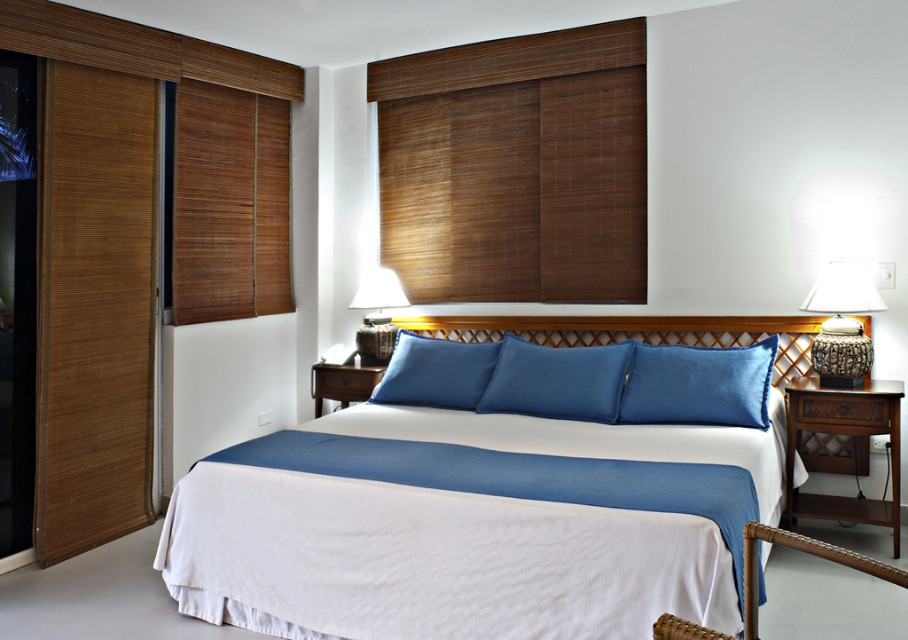
Question: Does blue fabric pillow at center have a greater width compared to blue matte pillow at center?

Choices:
 (A) yes
 (B) no

Answer: (A)

Question: Is brown woven blinds at upper center above rattan textured lamp at right?

Choices:
 (A) no
 (B) yes

Answer: (B)

Question: Does blue fabric pillow at center appear under blue matte pillow at center?

Choices:
 (A) yes
 (B) no

Answer: (A)

Question: Among these objects, which one is farthest from the camera?

Choices:
 (A) white cotton bed at center
 (B) blue fabric pillow at center
 (C) blue matte pillow at center
 (D) blue suede pillow at center

Answer: (C)

Question: Which object appears farthest from the camera in this image?

Choices:
 (A) blue matte pillow at center
 (B) white cotton bed at center
 (C) brown woven blinds at upper center

Answer: (C)

Question: Which is farther from the rattan textured lamp at right?

Choices:
 (A) brown bamboo blinds at left
 (B) blue suede pillow at center
 (C) transparent glass door at left

Answer: (C)